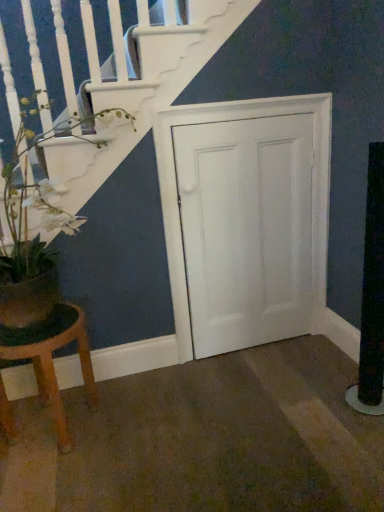
Question: Are green matte plant at left and white wood door at center far apart?

Choices:
 (A) yes
 (B) no

Answer: (B)

Question: Is green matte plant at left looking in the opposite direction of white wood door at center?

Choices:
 (A) yes
 (B) no

Answer: (B)

Question: Is green matte plant at left aimed at white wood door at center?

Choices:
 (A) no
 (B) yes

Answer: (A)

Question: Can you confirm if green matte plant at left is positioned to the right of white wood door at center?

Choices:
 (A) no
 (B) yes

Answer: (A)

Question: Is green matte plant at left further to the viewer compared to white wood door at center?

Choices:
 (A) yes
 (B) no

Answer: (B)

Question: Can you confirm if green matte plant at left is smaller than white wood door at center?

Choices:
 (A) yes
 (B) no

Answer: (B)

Question: Does green matte plant at left have a greater height compared to wooden stool at lower left?

Choices:
 (A) no
 (B) yes

Answer: (B)

Question: Does green matte plant at left have a lesser height compared to wooden stool at lower left?

Choices:
 (A) no
 (B) yes

Answer: (A)

Question: Does green matte plant at left turn towards wooden stool at lower left?

Choices:
 (A) yes
 (B) no

Answer: (B)

Question: Is green matte plant at left not near wooden stool at lower left?

Choices:
 (A) yes
 (B) no

Answer: (B)

Question: Can you confirm if green matte plant at left is thinner than wooden stool at lower left?

Choices:
 (A) no
 (B) yes

Answer: (A)

Question: Is green matte plant at left wider than wooden stool at lower left?

Choices:
 (A) no
 (B) yes

Answer: (B)

Question: Are white wood door at center and green matte plant at left making contact?

Choices:
 (A) yes
 (B) no

Answer: (B)